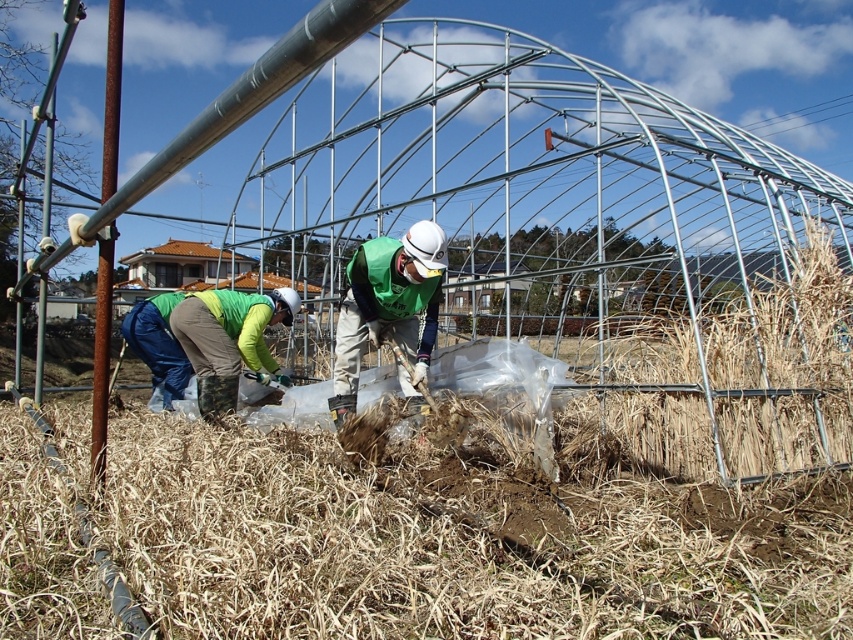
Question: Can you confirm if green fabric worker at center is positioned to the left of green fabric jacket at lower left?

Choices:
 (A) yes
 (B) no

Answer: (B)

Question: Which of the following is the closest to the observer?

Choices:
 (A) green fabric jacket at lower left
 (B) green fabric worker at center

Answer: (B)

Question: Can you confirm if green fabric worker at center is thinner than green fabric jacket at lower left?

Choices:
 (A) no
 (B) yes

Answer: (B)

Question: Does green fabric worker at center have a larger size compared to green fabric jacket at lower left?

Choices:
 (A) no
 (B) yes

Answer: (A)

Question: Which object is closer to the camera taking this photo?

Choices:
 (A) green fabric worker at center
 (B) green fabric jacket at lower left

Answer: (A)